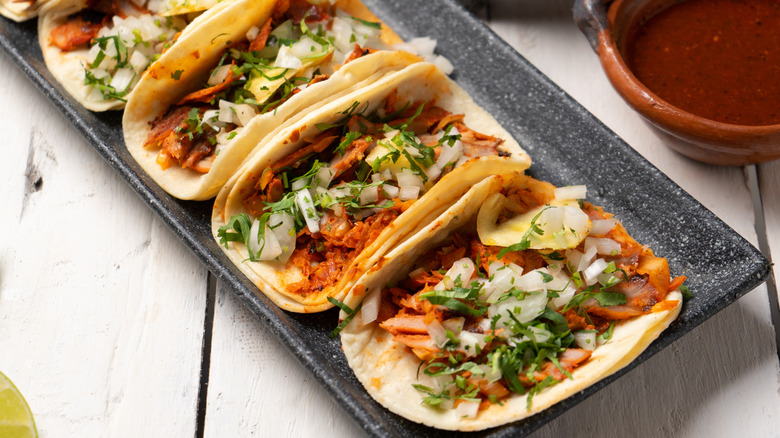
Where is `spaces between table planks`? Image resolution: width=780 pixels, height=438 pixels. spaces between table planks is located at coordinates pyautogui.click(x=207, y=317), pyautogui.click(x=757, y=215).